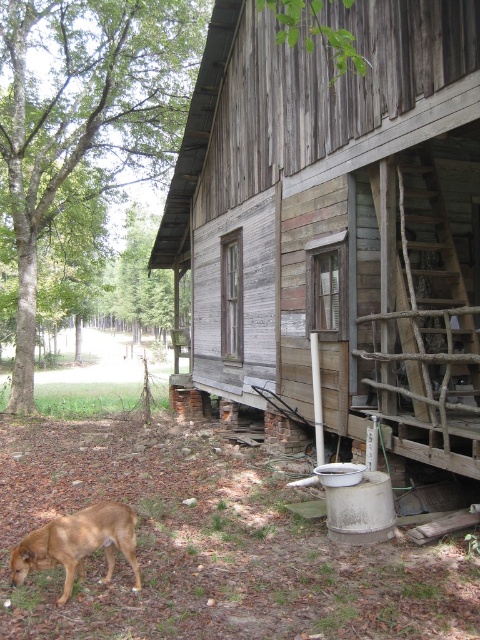
You are standing at the origin point in this rural scene. The weathered wood cabin at center is located at coordinates 0.348 on the x and 0.704 on the y. If you want to walk directly towards the cabin, which direction should you head?

Since the weathered wood cabin at center is located at coordinates x 0.348 and y 0.704, you should move northeast to reach it. The cabin is positioned to the northeast relative to your starting point at the origin.

Looking at this image, you are a delivery person with a package that requires a 3 meter wide path to navigate. You need to deliver it to the weathered wood cabin at center. Is the path between the cabin and the brown furry dog at lower left wide enough for your delivery vehicle?

The distance between the weathered wood cabin at center and the brown furry dog at lower left is 5.08 meters. Since the required path width is 3 meters, the 5.08 meter distance is sufficient for the delivery vehicle to pass through.